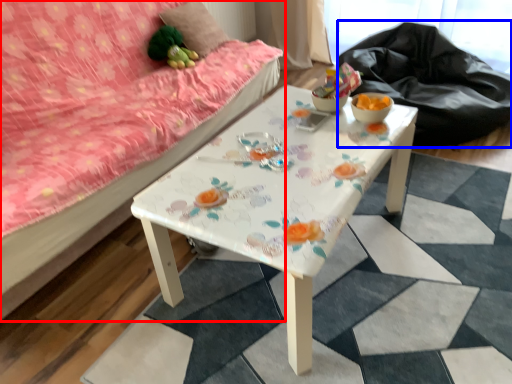
Question: Which point is closer to the camera, studio couch (highlighted by a red box) or sit (highlighted by a blue box)?

Choices:
 (A) studio couch
 (B) sit

Answer: (A)